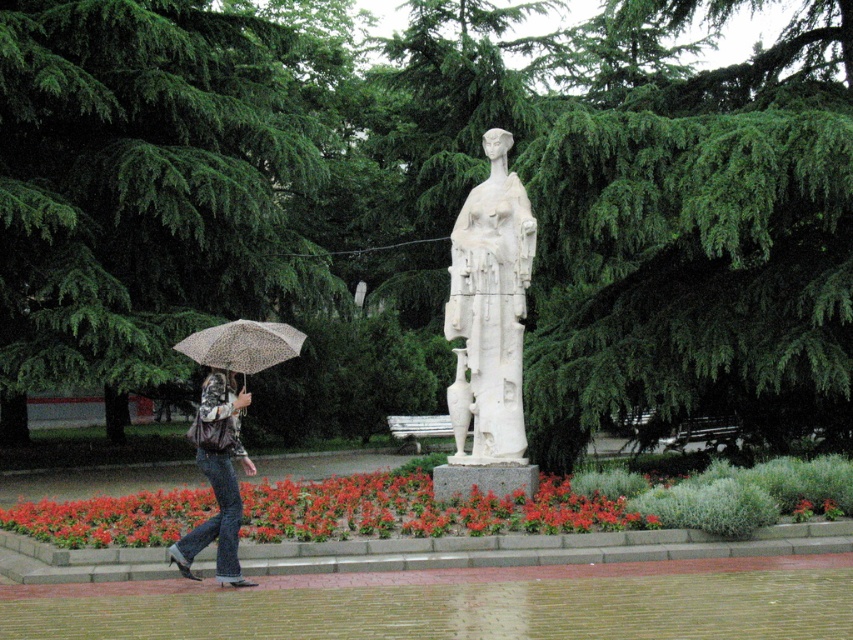
You are standing in the park and want to take a photo of the statue. The camera you are using has a focal length of 50mm and a sensor size of 24mm x 36mm. To ensure the statue is in focus, you need to calculate the hyperfocal distance. Given that the point at coordinates point (486, 372) is 39.48 feet away from the camera, what is the hyperfocal distance required for this shot?

The hyperfocal distance required for this shot is the distance at which the camera can focus to achieve acceptable sharpness from half the hyperfocal distance to infinity. Since the point at coordinates point (486, 372) is 39.48 feet away from the camera, the hyperfocal distance must be at least twice that distance to ensure the statue is in focus. Therefore, the hyperfocal distance should be approximately 78.96 feet.

You are standing in the park and want to take a photo of the white marble statue at center. If your camera has a maximum focus range of 30 feet, will you be able to capture the statue clearly?

The white marble statue at center is 38.97 feet away from camera, which exceeds the camera maximum focus range of 30 feet. Therefore, you will not be able to capture the statue clearly.

You are standing at the center of the park and want to take a photo of the statue. To avoid including the green leafy tree at center in your photo, which direction should you move? Please provide your answer in terms of compass directions like north, south, east, or west.

Since the green leafy tree at center is located at point coordinates of (424,209), you should move to the north or south direction to avoid it. Moving north would take you away from the tree towards the top of the frame, while moving south would direct you away from it towards the bottom. This ensures the tree is no longer in the center of your photo.